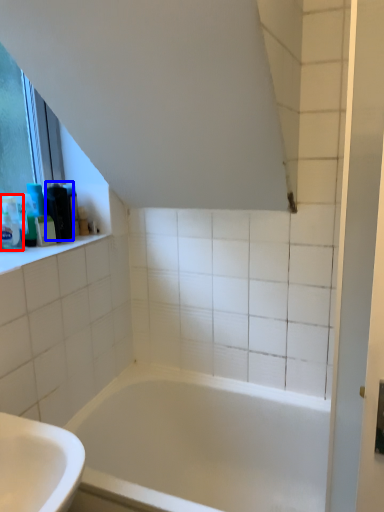
Question: Which of the following is the closest to the observer, toiletry (highlighted by a red box) or toiletry (highlighted by a blue box)?

Choices:
 (A) toiletry
 (B) toiletry

Answer: (A)